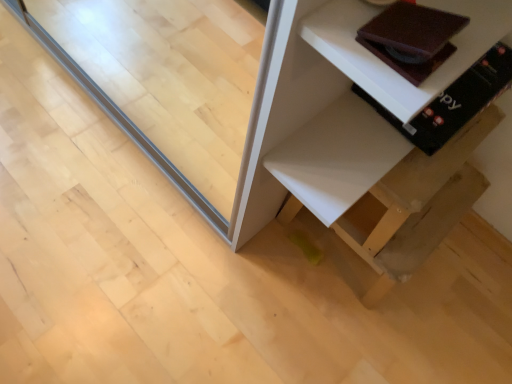
Question: From the image's perspective, would you say white matte shelf at lower right is shown under brown leather book at upper right, the 2th book viewed from the front?

Choices:
 (A) no
 (B) yes

Answer: (B)

Question: Is white matte shelf at lower right taller than brown leather book at upper right, placed as the 1th book when sorted from back to front?

Choices:
 (A) no
 (B) yes

Answer: (B)

Question: From a real-world perspective, is white matte shelf at lower right positioned over brown leather book at upper right, placed as the 1th book when sorted from back to front, based on gravity?

Choices:
 (A) yes
 (B) no

Answer: (B)

Question: Is white matte shelf at lower right bigger than brown leather book at upper right, placed as the 1th book when sorted from back to front?

Choices:
 (A) no
 (B) yes

Answer: (B)

Question: Is white matte shelf at lower right at the right side of brown leather book at upper right, the 2th book viewed from the front?

Choices:
 (A) no
 (B) yes

Answer: (A)

Question: Based on their positions, is white matte shelf at lower right located to the left or right of matte brown book at upper right, which appears as the second book when viewed from the back?

Choices:
 (A) right
 (B) left

Answer: (A)

Question: Is point (289, 188) closer or farther from the camera than point (358, 33)?

Choices:
 (A) closer
 (B) farther

Answer: (B)

Question: Considering the positions of white matte shelf at lower right and matte brown book at upper right, which appears as the 1th book when viewed from the front, in the image, is white matte shelf at lower right taller or shorter than matte brown book at upper right, which appears as the 1th book when viewed from the front,?

Choices:
 (A) short
 (B) tall

Answer: (B)

Question: Relative to matte brown book at upper right, which appears as the 1th book when viewed from the front, is white matte shelf at lower right in front or behind?

Choices:
 (A) behind
 (B) front

Answer: (A)

Question: Which is correct: white matte shelf at lower right is inside transparent glass door at center, or outside of it?

Choices:
 (A) outside
 (B) inside

Answer: (A)

Question: In terms of width, does white matte shelf at lower right look wider or thinner when compared to transparent glass door at center?

Choices:
 (A) wide
 (B) thin

Answer: (A)

Question: Considering the positions of point (263, 220) and point (150, 102), is point (263, 220) closer or farther from the camera than point (150, 102)?

Choices:
 (A) farther
 (B) closer

Answer: (B)

Question: From their relative heights in the image, would you say white matte shelf at lower right is taller or shorter than transparent glass door at center?

Choices:
 (A) tall
 (B) short

Answer: (B)

Question: In the image, is white matte shelf at lower right positioned in front of or behind brown leather book at upper right, the 2th book viewed from the front?

Choices:
 (A) behind
 (B) front

Answer: (B)

Question: From a real-world perspective, is white matte shelf at lower right physically located above or below brown leather book at upper right, the 2th book viewed from the front?

Choices:
 (A) below
 (B) above

Answer: (A)